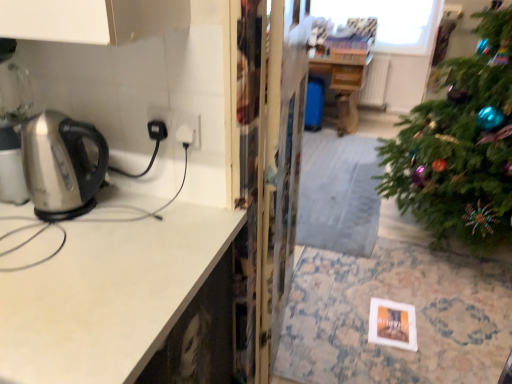
The image size is (512, 384). Find the location of `free space to the right of transparent plastic screen door at center`. free space to the right of transparent plastic screen door at center is located at coordinates (355, 303).